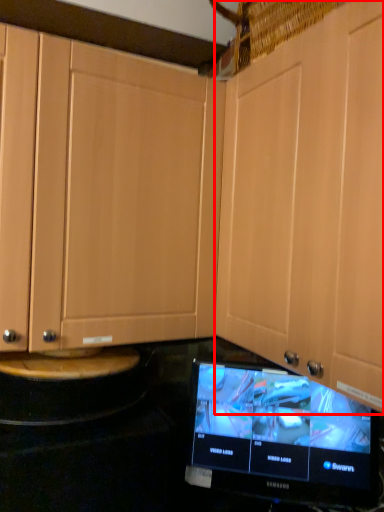
Question: From the image's perspective, what is the correct spatial positioning of cabinetry (annotated by the red box) in reference to television?

Choices:
 (A) below
 (B) above

Answer: (B)